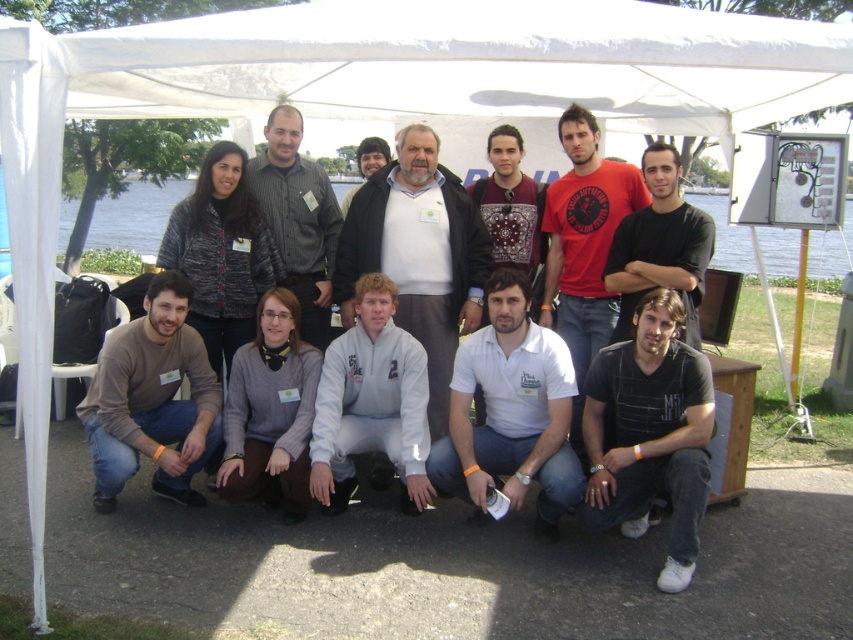
Looking at the group under the white canopy tent, can you tell me which of the two shirts at the center is positioned to the right of the other? Specifically, is the white cotton shirt at center to the right of the gray shirt at center or vice versa?

The white cotton shirt at center is positioned to the right of the gray shirt at center.